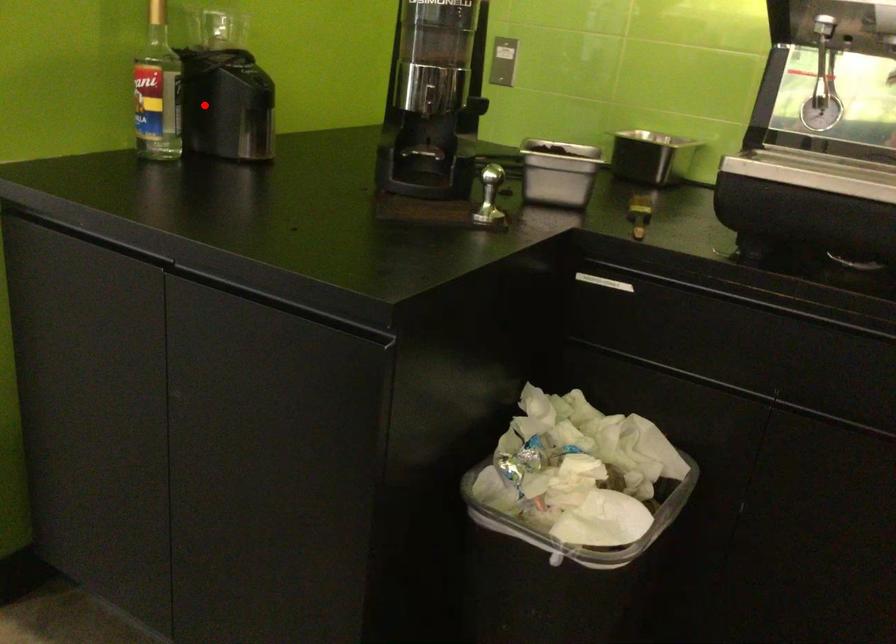
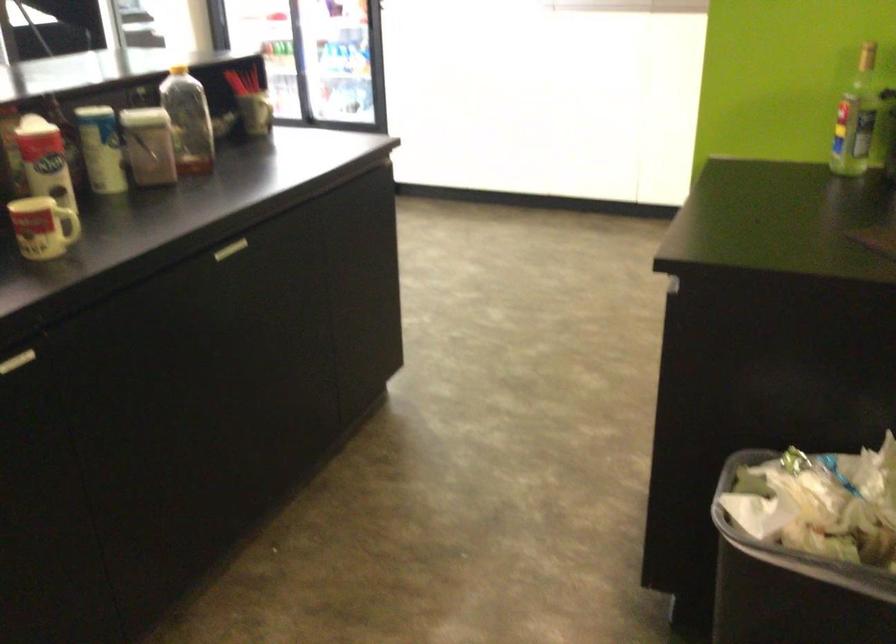
Question: A red point is marked in image1. In image2, is the corresponding 3D point closer to the camera or farther? Reply with the corresponding letter.

Choices:
 (A) The corresponding 3D point is closer.
 (B) The corresponding 3D point is farther.

Answer: (B)